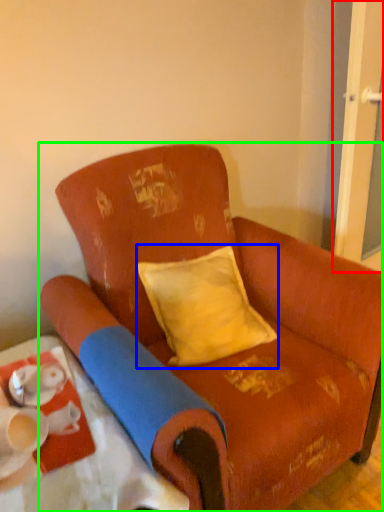
Question: Based on their relative distances, which object is farther from screen door (highlighted by a red box)? Choose from pillow (highlighted by a blue box) and chair (highlighted by a green box).

Choices:
 (A) pillow
 (B) chair

Answer: (B)